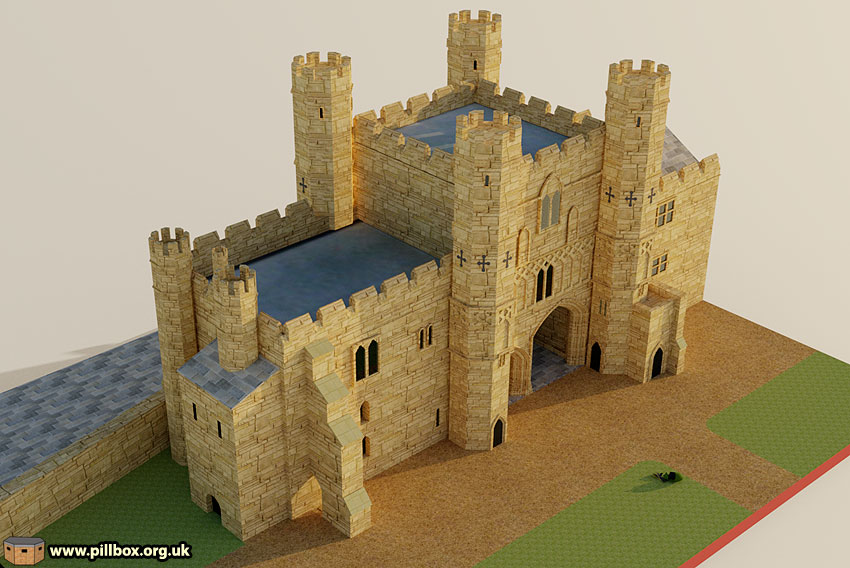
The image size is (850, 568). I want to click on door way, so click(546, 354).